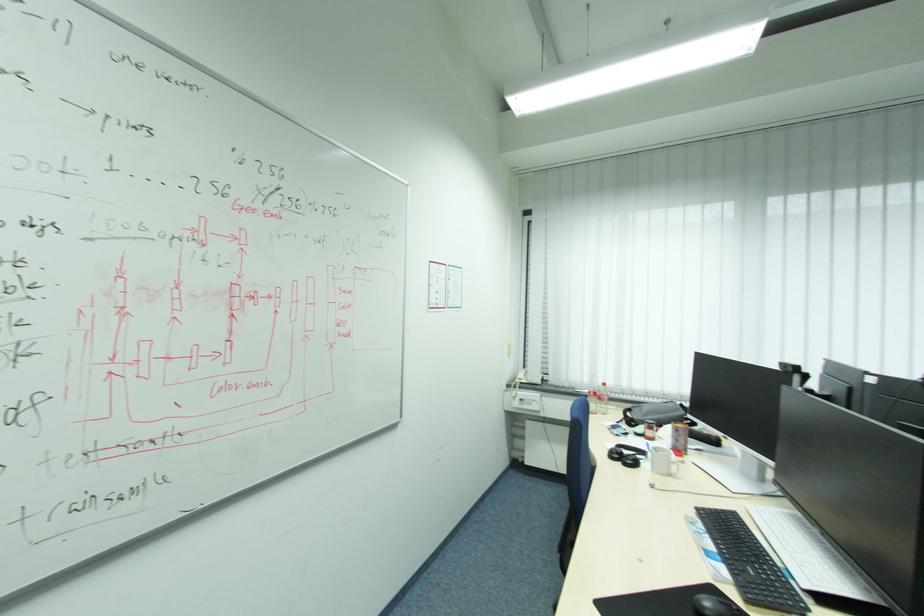
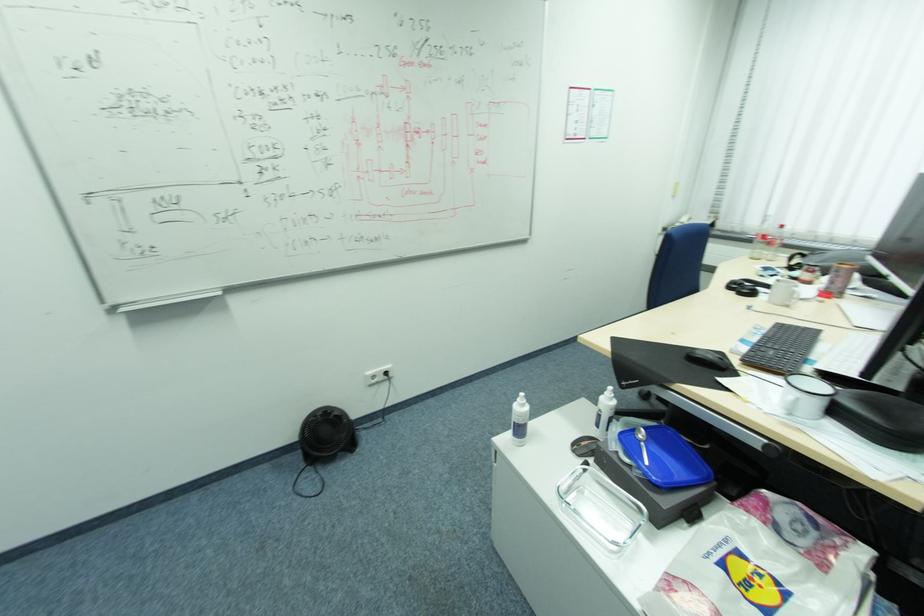
First-person continuous shooting, in which direction is the camera rotating?

The camera rotated toward left-down.